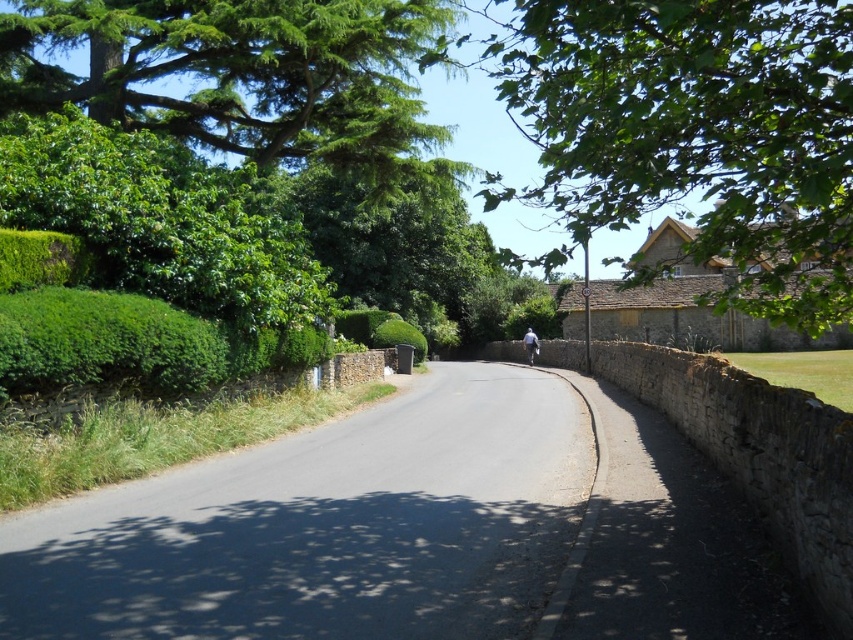
Find the location of a particular element. This screenshot has height=640, width=853. green leafy tree at upper right is located at coordinates (694, 132).

Between point (659, 125) and point (142, 26), which one is positioned behind?

Positioned behind is point (142, 26).

What do you see at coordinates (694, 132) in the screenshot? I see `green leafy tree at upper right` at bounding box center [694, 132].

The image size is (853, 640). What are the coordinates of `green leafy tree at upper right` in the screenshot? It's located at (694, 132).

Who is more forward, (834, 218) or (529, 339)?

Positioned in front is point (834, 218).

Is point (662, 122) more distant than point (525, 342)?

No, it is not.

You are a GUI agent. You are given a task and a screenshot of the screen. Output one action in this format:
    pyautogui.click(x=<x>, y=<y>)
    Task: Click on the green leafy tree at upper right
    The image size is (853, 640).
    Given the screenshot: What is the action you would take?
    pyautogui.click(x=694, y=132)

Between green leafy tree at upper left and light blue fabric at center, which one is positioned lower?

light blue fabric at center is lower down.

In the scene shown: Which of these two, green leafy tree at upper left or light blue fabric at center, stands shorter?

light blue fabric at center is shorter.

This screenshot has width=853, height=640. I want to click on green leafy tree at upper left, so click(x=245, y=76).